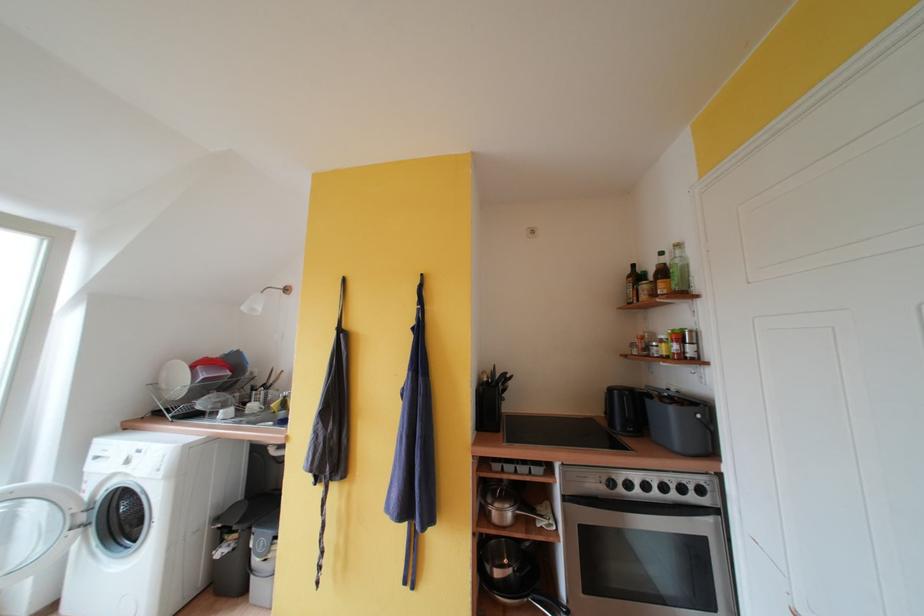
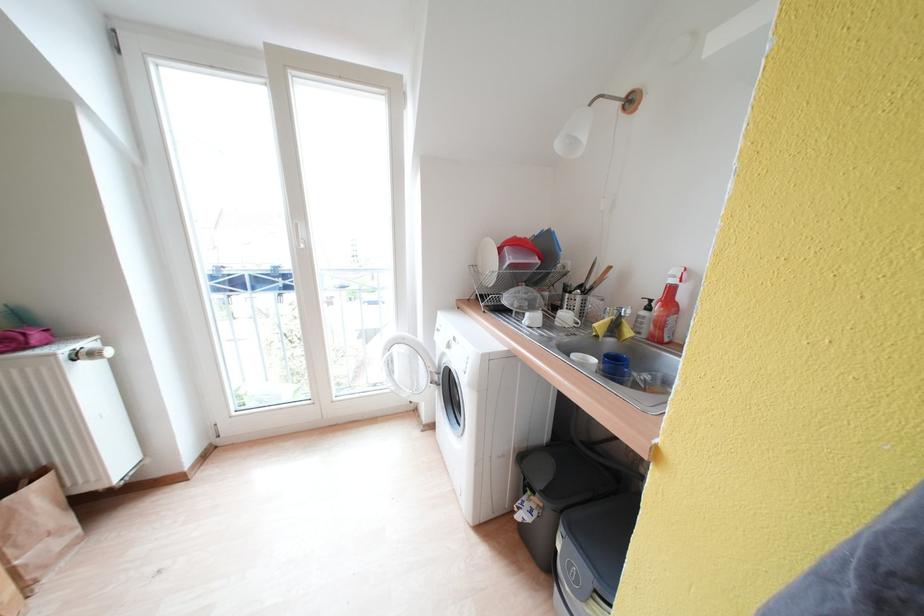
Locate, in the second image, the point that corresponds to (x=199, y=371) in the first image.

(505, 254)